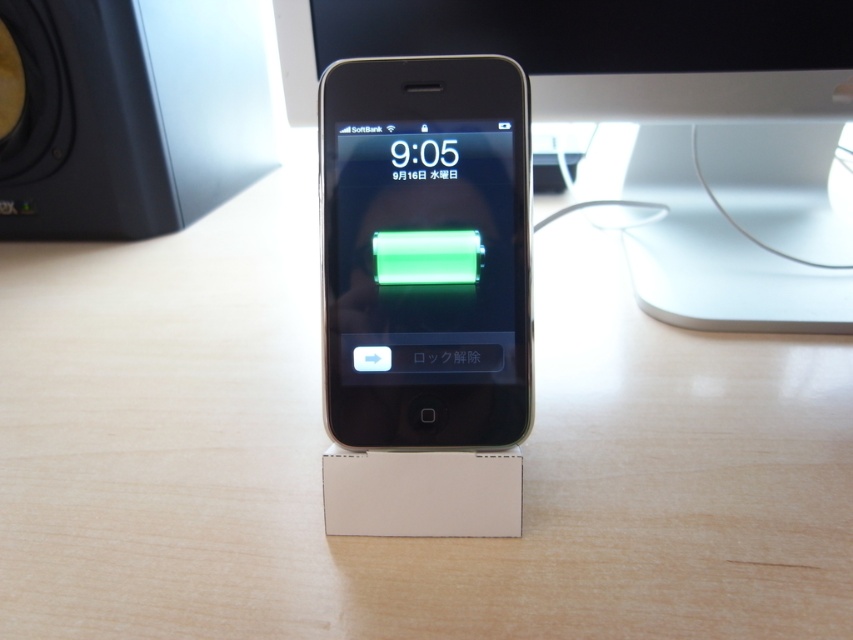
Which is below, black glossy computer monitor at upper center or black matte speaker at upper left?

black glossy computer monitor at upper center is lower down.

Which is more to the right, black glossy computer monitor at upper center or black matte speaker at upper left?

From the viewer's perspective, black glossy computer monitor at upper center appears more on the right side.

Which is behind, point (424, 51) or point (53, 58)?

Point (53, 58)

The height and width of the screenshot is (640, 853). I want to click on black glossy computer monitor at upper center, so click(x=660, y=131).

Between point (828, 10) and point (521, 330), which one is positioned behind?

Positioned behind is point (828, 10).

Find the location of `black glossy computer monitor at upper center`. black glossy computer monitor at upper center is located at coordinates (660, 131).

Describe the element at coordinates (660, 131) in the screenshot. The width and height of the screenshot is (853, 640). I see `black glossy computer monitor at upper center` at that location.

Find the location of a particular element. The width and height of the screenshot is (853, 640). black glossy computer monitor at upper center is located at coordinates [660, 131].

Is point (412, 192) closer to camera compared to point (164, 205)?

Yes, point (412, 192) is closer to viewer.

Who is shorter, satin black ipod at center or black matte speaker at upper left?

With less height is satin black ipod at center.

Image resolution: width=853 pixels, height=640 pixels. Identify the location of satin black ipod at center. (425, 252).

Locate an element on the screen. satin black ipod at center is located at coordinates (425, 252).